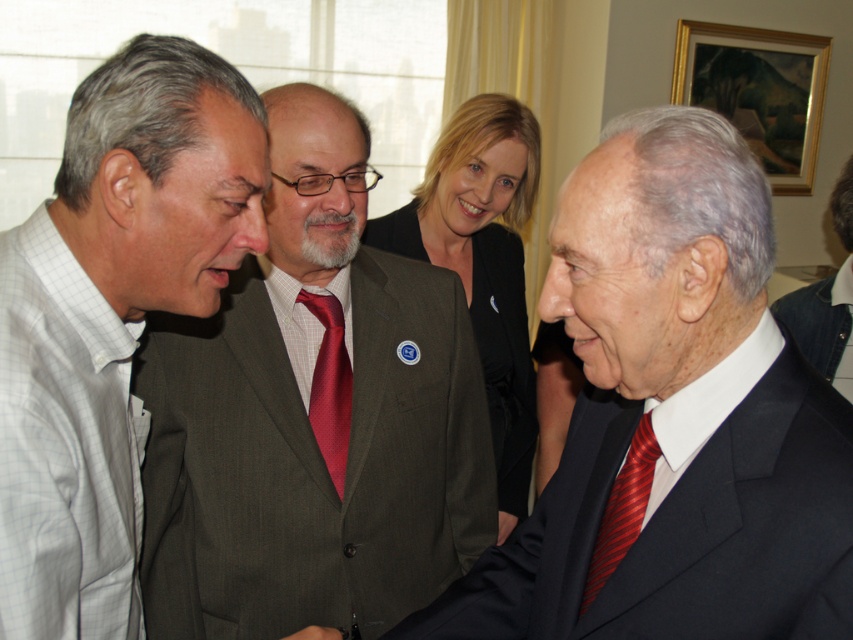
Based on the scene description, can you determine the spatial relationship between the matte gray suit at center and the smooth skin hand at lower left?

The matte gray suit at center is above the smooth skin hand at lower left.

Consider the image. You are a photographer adjusting the camera focus. The camera can only focus on objects within a 30 inch range. Given the distance between the matte black blazer at center and the shiny red tie at center, will the camera focus on both objects simultaneously?

The distance between the matte black blazer at center and the shiny red tie at center is 33.69 inches, which exceeds the camera focus range of 30 inches. Therefore, the camera cannot focus on both objects simultaneously.

Looking at this image, you are organizing a photo shoot and need to arrange these two individuals so that their sizes appear balanced in the frame. Given the current sizes of the gray checkered shirt at left and the dark gray suit at right, what adjustment could you make to achieve this balance?

To balance their sizes, you could position the gray checkered shirt at left farther away from the camera and move the dark gray suit at right closer. Since the gray checkered shirt at left is currently larger, increasing its distance and decreasing the distance of the dark gray suit at right would help create visual balance between them.